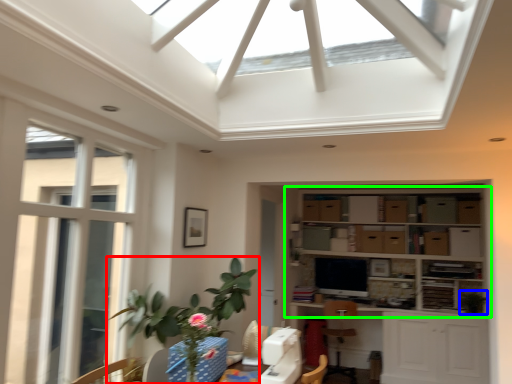
Question: Considering the real-world distances, which object is farthest from houseplant (highlighted by a red box)? plant (highlighted by a blue box) or shelf (highlighted by a green box)?

Choices:
 (A) plant
 (B) shelf

Answer: (A)